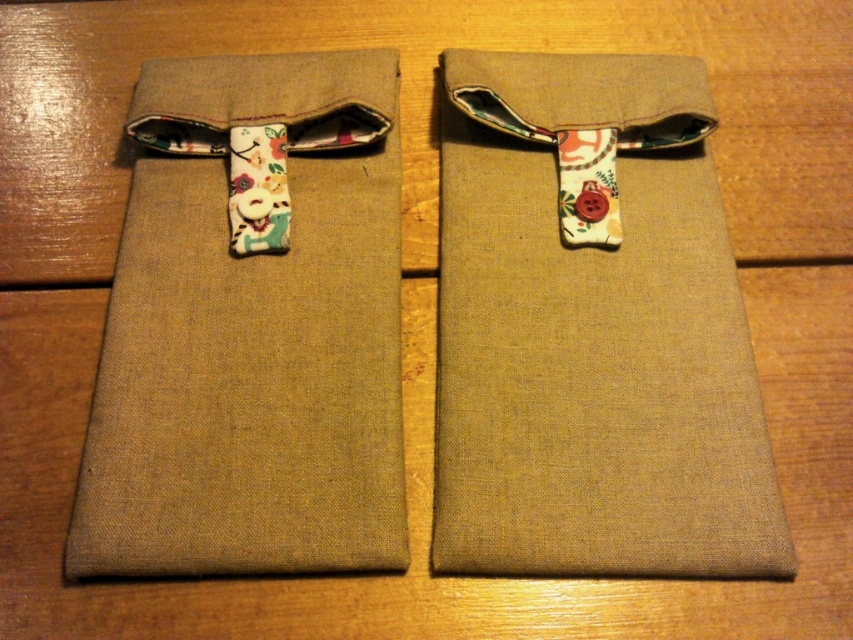
Between floral fabric tie at center and floral fabric strap at upper center, which one has less height?

floral fabric strap at upper center

Who is more forward, [263,250] or [686,129]?

Positioned in front is point [263,250].

You are a GUI agent. You are given a task and a screenshot of the screen. Output one action in this format:
    pyautogui.click(x=<x>, y=<y>)
    Task: Click on the floral fabric tie at center
    
    Given the screenshot: What is the action you would take?
    pyautogui.click(x=258, y=189)

Which is more to the right, matte brown fabric pouch at center or floral fabric strap at upper center?

Positioned to the right is floral fabric strap at upper center.

Is matte brown fabric pouch at center further to the viewer compared to floral fabric strap at upper center?

That is False.

What do you see at coordinates (592, 330) in the screenshot? The height and width of the screenshot is (640, 853). I see `matte brown fabric pouch at center` at bounding box center [592, 330].

Find the location of a particular element. The width and height of the screenshot is (853, 640). matte brown fabric pouch at center is located at coordinates (592, 330).

Is matte brown fabric pouch at center to the right of matte beige fabric pouch at left from the viewer's perspective?

Correct, you'll find matte brown fabric pouch at center to the right of matte beige fabric pouch at left.

Is matte brown fabric pouch at center wider than matte beige fabric pouch at left?

Correct, the width of matte brown fabric pouch at center exceeds that of matte beige fabric pouch at left.

This screenshot has height=640, width=853. Find the location of `matte brown fabric pouch at center`. matte brown fabric pouch at center is located at coordinates (592, 330).